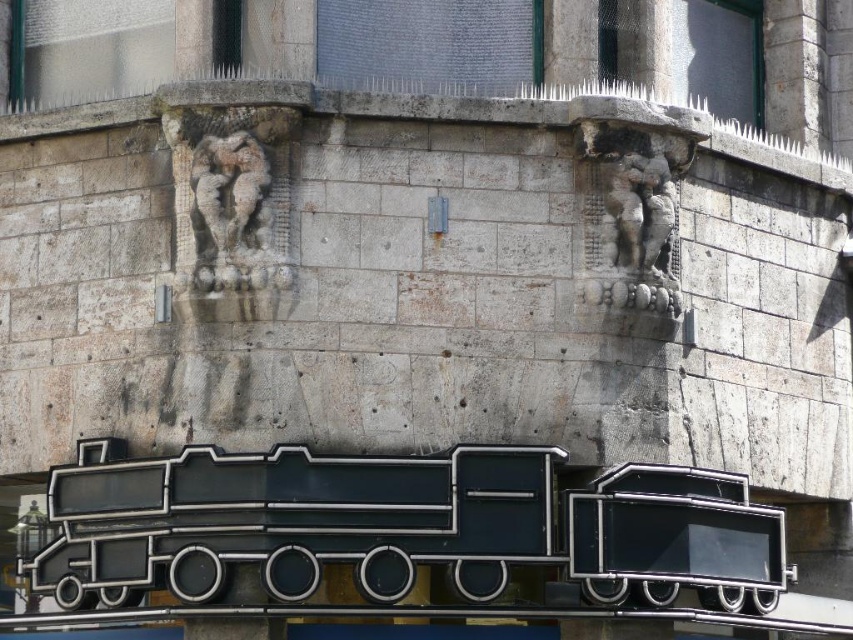
Does rustic stone cherubim at upper right appear over carved stone cherub at upper center?

Actually, rustic stone cherubim at upper right is below carved stone cherub at upper center.

Between point (630, 154) and point (234, 148), which one is positioned in front?

Point (234, 148)

Does point (677, 132) come farther from viewer compared to point (206, 145)?

Yes, point (677, 132) is behind point (206, 145).

Locate an element on the screen. rustic stone cherubim at upper right is located at coordinates (637, 211).